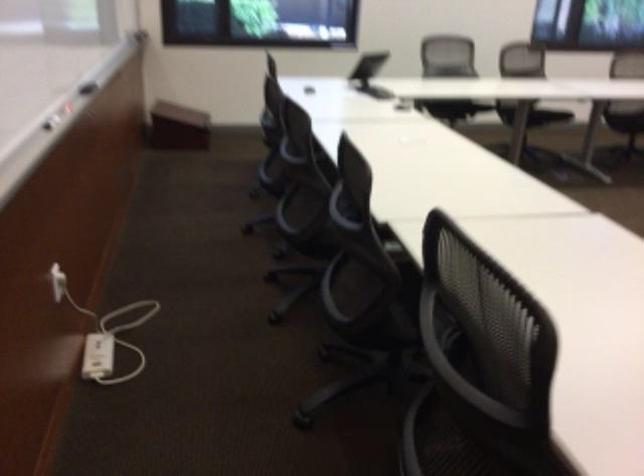
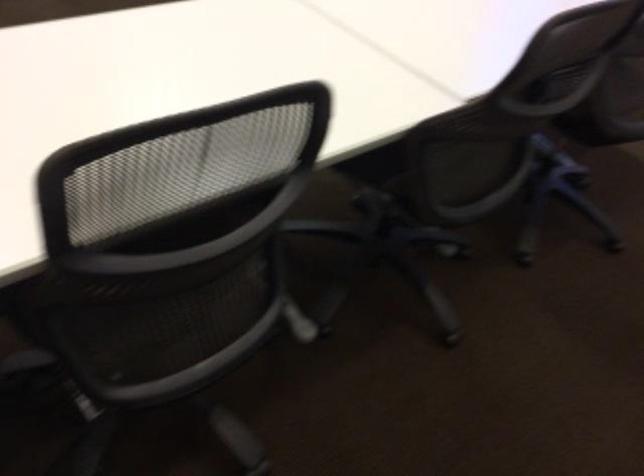
Question: In a continuous first-person perspective shot, in which direction is the camera moving?

Choices:
 (A) Left
 (B) Right
 (C) Forward
 (D) Backward

Answer: (D)